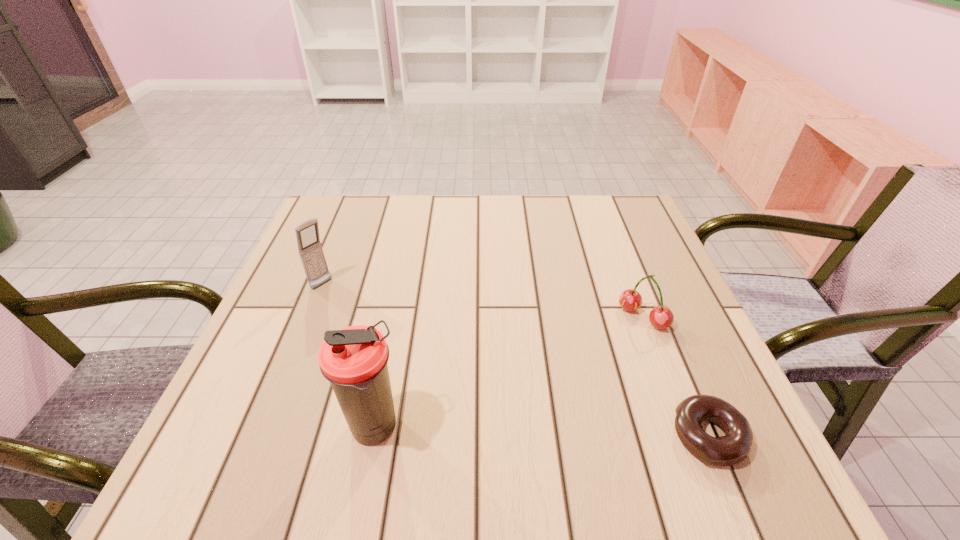
Find the location of a particular element. The image size is (960, 540). thermos bottle is located at coordinates (354, 359).

The image size is (960, 540). In order to click on the second object from left to right in this screenshot , I will do `click(354, 359)`.

Identify the location of doughnut. (735, 446).

Image resolution: width=960 pixels, height=540 pixels. Identify the location of cellular telephone. (311, 253).

This screenshot has height=540, width=960. In order to click on the leftmost object in this screenshot , I will do `click(311, 253)`.

Locate an element on the screen. The image size is (960, 540). the second shortest object is located at coordinates (661, 317).

Locate an element on the screen. The height and width of the screenshot is (540, 960). cherry is located at coordinates (661, 317).

Identify the location of vacant space located 0.190m on the back of the thermos bottle. The image size is (960, 540). (396, 322).

Find the location of a particular element. free space located on the back of the doughnut is located at coordinates (644, 285).

Identify the location of vacant space located 0.200m on the front-facing side of the cellular telephone. This screenshot has width=960, height=540. (387, 333).